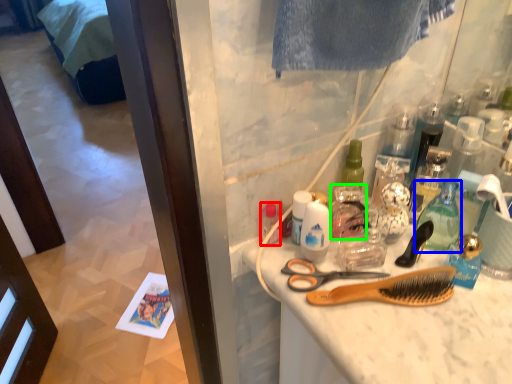
Question: Which object is the closest to the toiletry (highlighted by a red box)? Choose among these: bottle (highlighted by a blue box) or cleaning product (highlighted by a green box).

Choices:
 (A) bottle
 (B) cleaning product

Answer: (B)